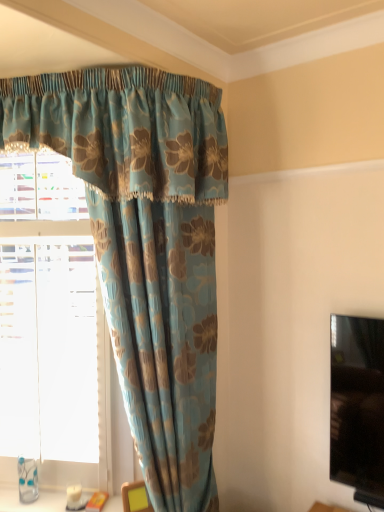
Question: From the image's perspective, does blue floral fabric curtain at upper left appear higher than yellow fabric at lower center?

Choices:
 (A) no
 (B) yes

Answer: (B)

Question: Would you say blue floral fabric curtain at upper left is outside yellow fabric at lower center?

Choices:
 (A) no
 (B) yes

Answer: (B)

Question: Is yellow fabric at lower center at the back of blue floral fabric curtain at upper left?

Choices:
 (A) no
 (B) yes

Answer: (B)

Question: Is blue floral fabric curtain at upper left at the right side of yellow fabric at lower center?

Choices:
 (A) yes
 (B) no

Answer: (A)

Question: Is blue floral fabric curtain at upper left closer to camera compared to yellow fabric at lower center?

Choices:
 (A) no
 (B) yes

Answer: (B)

Question: From a real-world perspective, is blue floral fabric curtain at upper left over yellow fabric at lower center?

Choices:
 (A) yes
 (B) no

Answer: (A)

Question: Considering the relative sizes of blue floral curtain at upper left and yellow fabric at lower center in the image provided, is blue floral curtain at upper left shorter than yellow fabric at lower center?

Choices:
 (A) yes
 (B) no

Answer: (B)

Question: Is blue floral curtain at upper left at the right side of yellow fabric at lower center?

Choices:
 (A) no
 (B) yes

Answer: (A)

Question: Considering the relative sizes of blue floral curtain at upper left and yellow fabric at lower center in the image provided, is blue floral curtain at upper left taller than yellow fabric at lower center?

Choices:
 (A) no
 (B) yes

Answer: (B)

Question: Does blue floral curtain at upper left lie behind yellow fabric at lower center?

Choices:
 (A) yes
 (B) no

Answer: (B)

Question: From a real-world perspective, is blue floral curtain at upper left on top of yellow fabric at lower center?

Choices:
 (A) yes
 (B) no

Answer: (A)

Question: From the image's perspective, does blue floral curtain at upper left appear lower than yellow fabric at lower center?

Choices:
 (A) no
 (B) yes

Answer: (A)

Question: From a real-world perspective, is blue floral fabric curtain at upper left under blue floral curtain at upper left?

Choices:
 (A) yes
 (B) no

Answer: (A)